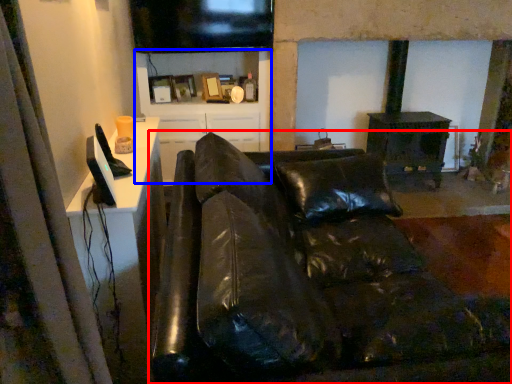
Question: Which point is further to the camera, studio couch (highlighted by a red box) or tv cabinet (highlighted by a blue box)?

Choices:
 (A) studio couch
 (B) tv cabinet

Answer: (B)